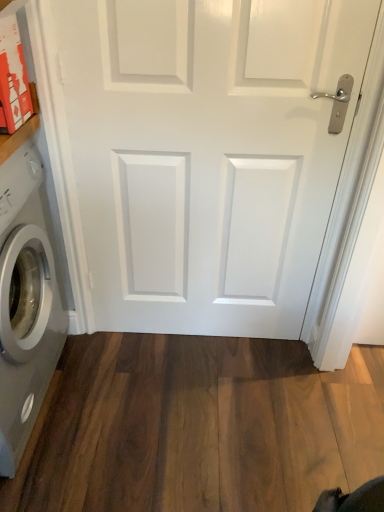
I want to click on vacant space in front of white glossy door at center, so click(x=200, y=415).